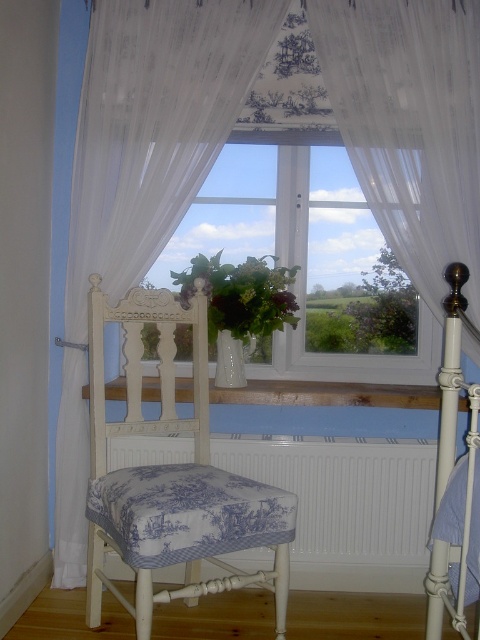
You are standing in the bedroom and want to place a small plant on the surface closest to the window. Which object, the white painted metal bed at right or the white wooden balustrade at center, should you choose?

The white wooden balustrade at center is closer to the window than the white painted metal bed at right, so you should place the plant on the white wooden balustrade at center.

You are a delivery person trying to place a new bed frame that is 30 inches wide into the bedroom. The current bed is the white painted metal bed at right. Can you move the white glass window at center to make space for the new bed frame?

The white glass window at center is 26.68 inches away from the white painted metal bed at right. Since the new bed frame is 30 inches wide and the distance between them is less than that, moving the window won

You are planning to hang a large painting that is 1.5 meters wide on the wall between the white glass window at center and the white painted metal bed at right. Given the spacing between them, will the painting fit without overlapping either object?

The white glass window at center is wider than the white painted metal bed at right. However, the exact distance between them isn t provided in the scene description. To determine if the painting will fit, you would need to measure the space between the two objects to ensure it s at least 1.5 meters wide.